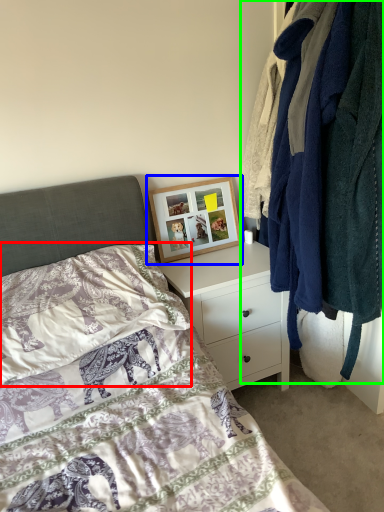
Question: Estimate the real-world distances between objects in this image. Which object is farther from pillow (highlighted by a red box), picture frame (highlighted by a blue box) or closet (highlighted by a green box)?

Choices:
 (A) picture frame
 (B) closet

Answer: (B)